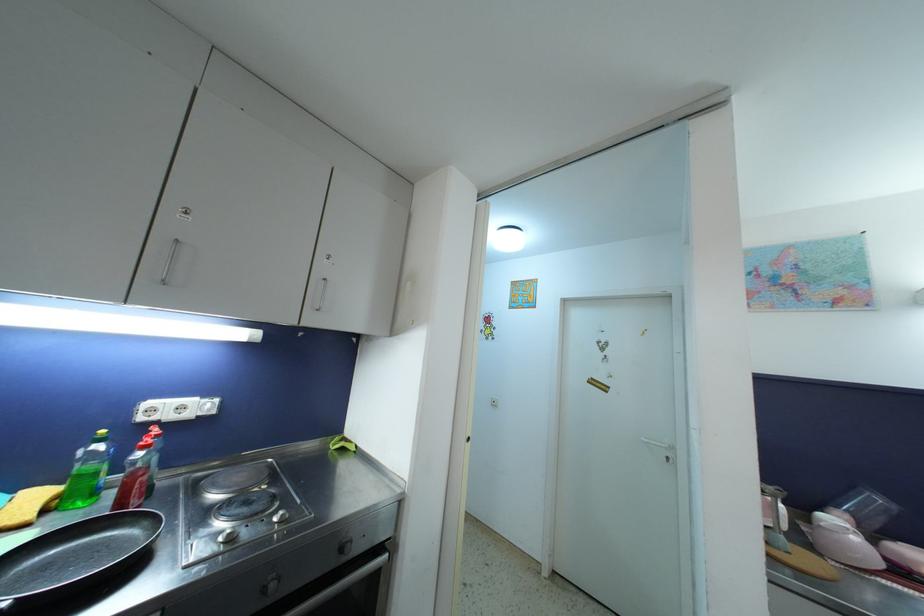
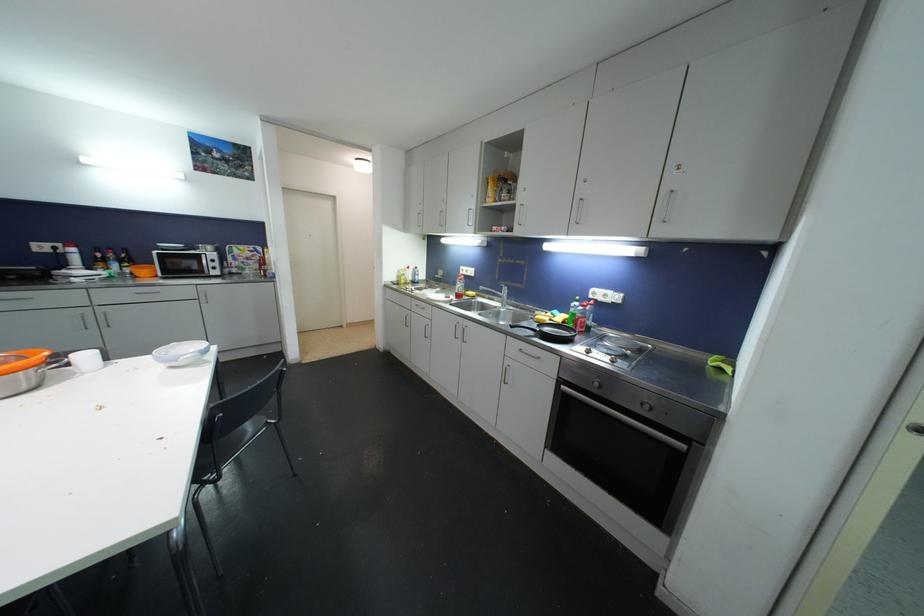
Question: How did the camera likely rotate?

Choices:
 (A) Left
 (B) Right
 (C) Up
 (D) Down

Answer: (A)